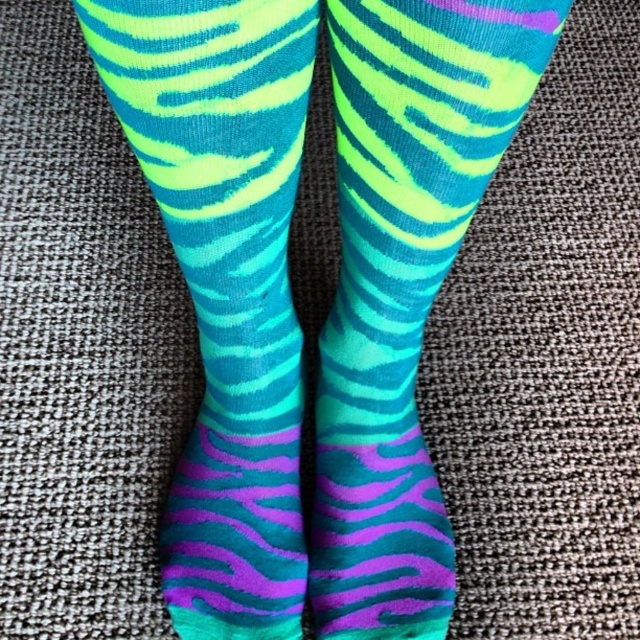
Question: Is neon green fabric socks at left above neon green fabric socks at center?

Choices:
 (A) yes
 (B) no

Answer: (A)

Question: Can you confirm if neon green fabric socks at left is wider than neon green fabric socks at center?

Choices:
 (A) no
 (B) yes

Answer: (A)

Question: Does neon green fabric socks at left have a lesser width compared to neon green fabric socks at center?

Choices:
 (A) yes
 (B) no

Answer: (A)

Question: Which object appears closest to the camera in this image?

Choices:
 (A) neon green fabric socks at center
 (B) neon green fabric socks at left

Answer: (B)